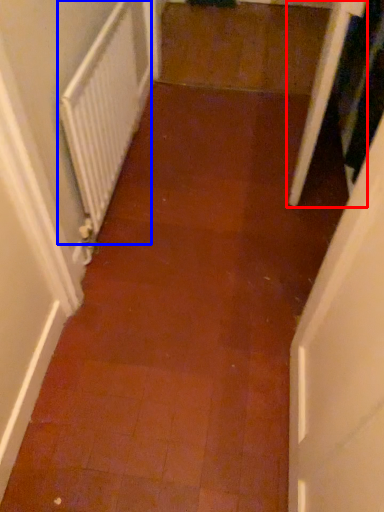
Question: Which object is closer to the camera taking this photo, screen door (highlighted by a red box) or radiator (highlighted by a blue box)?

Choices:
 (A) screen door
 (B) radiator

Answer: (B)